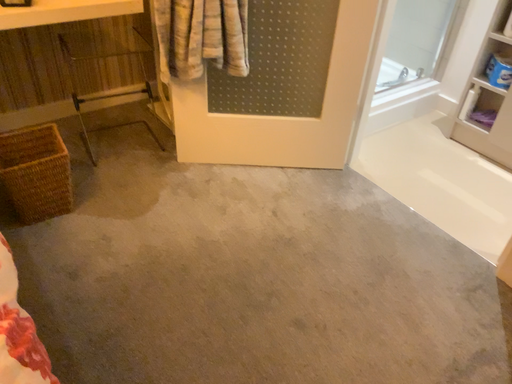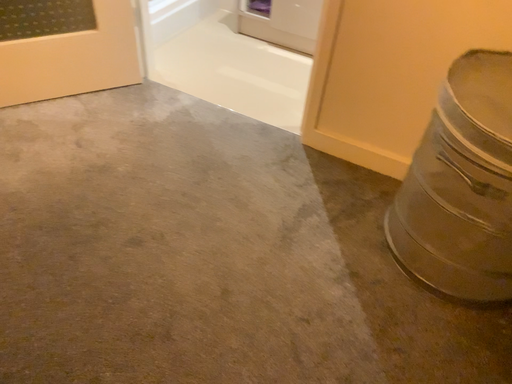
Question: How did the camera likely rotate when shooting the video?

Choices:
 (A) rotated right
 (B) rotated left

Answer: (A)